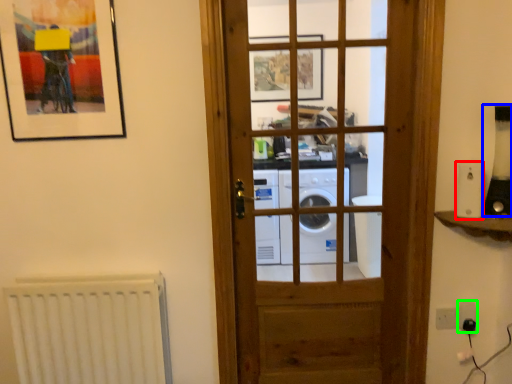
Question: Based on their relative distances, which object is nearer to appliance (highlighted by a red box)? Choose from appliance (highlighted by a blue box) and electric outlet (highlighted by a green box).

Choices:
 (A) appliance
 (B) electric outlet

Answer: (A)